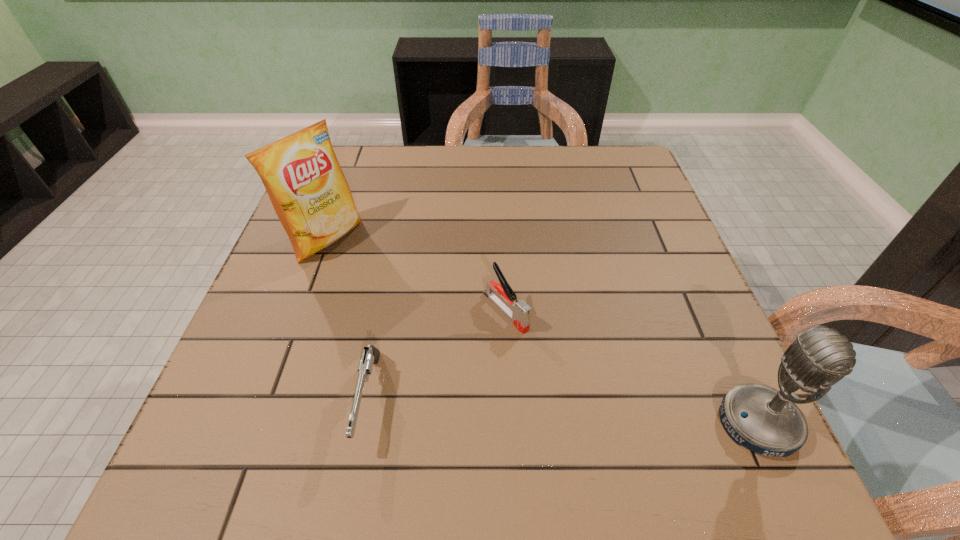
At what (x,y) coordinates should I click in order to perform the action: click on vacant spot on the desktop that is between the pistol and the rightmost object and is positioned on the front-facing side of the crisp (potato chip). Please return your answer as a coordinate pair (x, y). This screenshot has width=960, height=540. Looking at the image, I should click on 596,414.

Where is `free space on the desktop that is between the shortest object and the rightmost object and is positioned on the handle side of the stapler`? The image size is (960, 540). free space on the desktop that is between the shortest object and the rightmost object and is positioned on the handle side of the stapler is located at coordinates (612, 415).